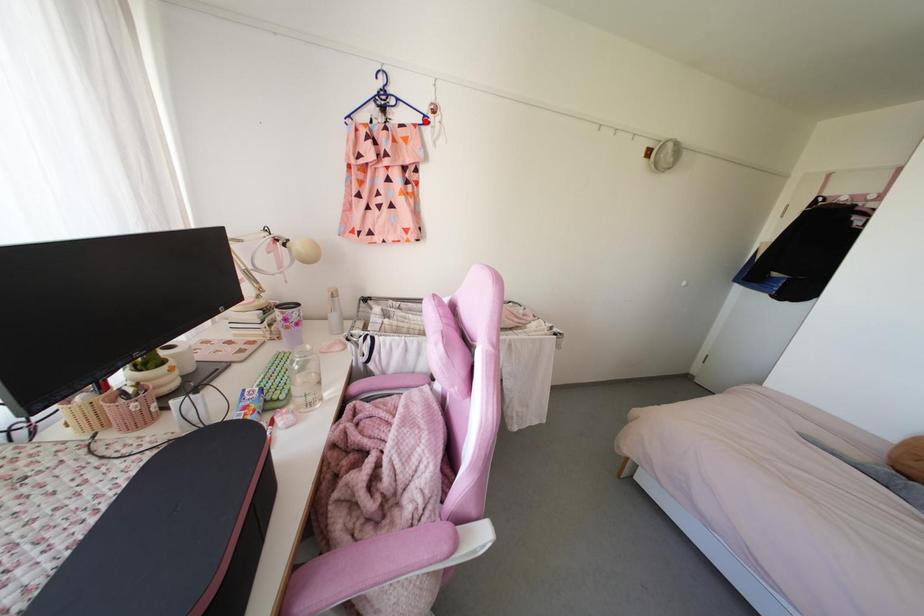
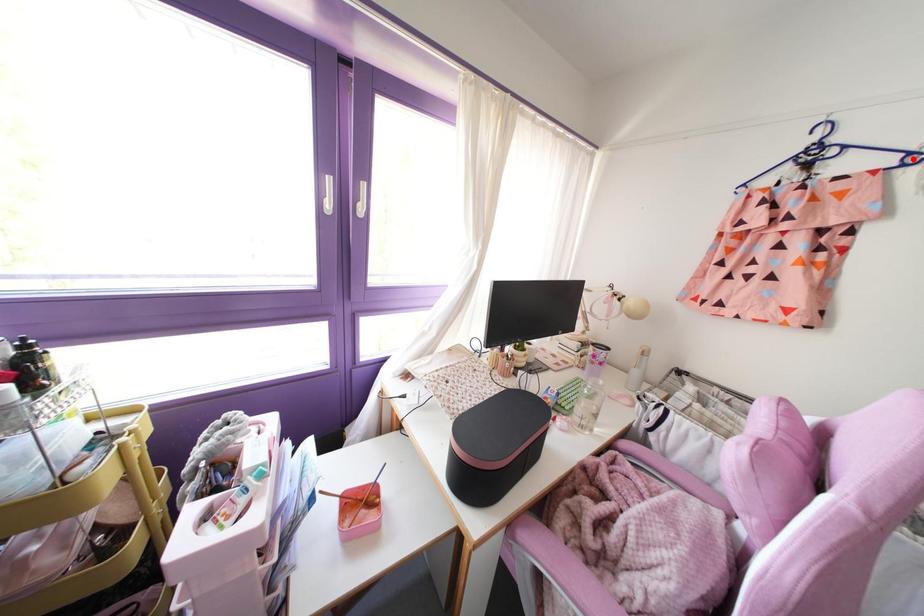
I am providing you with two images of the same scene from different viewpoints. A red point is marked on the first image and another point is marked on the second image. Does the point marked in image1 correspond to the same location as the one in image2?

Yes